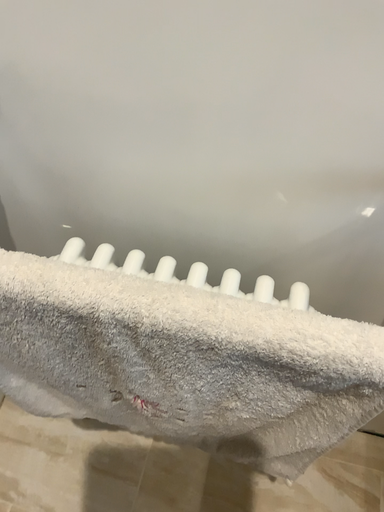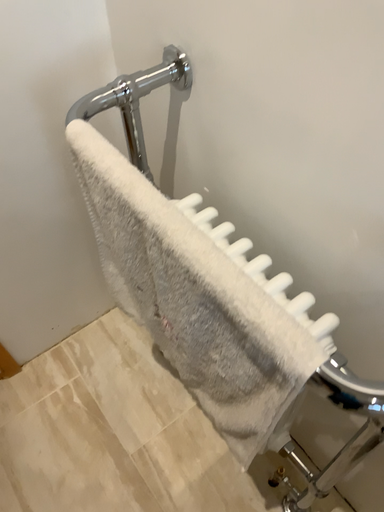
Question: Which way did the camera rotate in the video?

Choices:
 (A) rotated upward
 (B) rotated downward

Answer: (A)